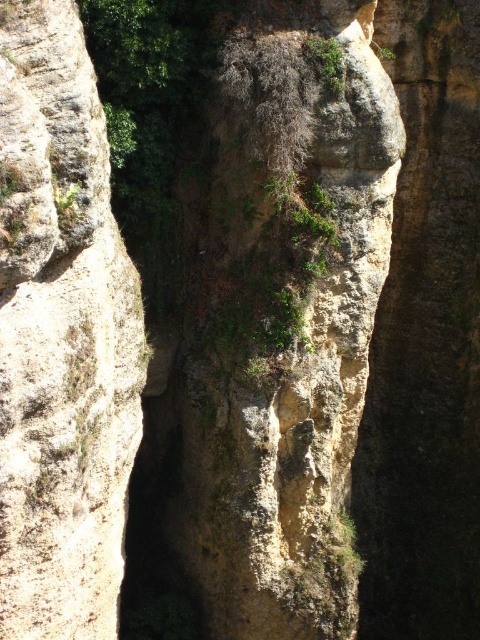
Question: Can you confirm if rough textured rock at center is positioned to the right of green leafy vegetation at upper center?

Choices:
 (A) no
 (B) yes

Answer: (A)

Question: Which point is farther to the camera?

Choices:
 (A) green leafy vegetation at upper center
 (B) rough textured rock at center

Answer: (A)

Question: Does rough textured rock at center come in front of green leafy vegetation at upper center?

Choices:
 (A) no
 (B) yes

Answer: (B)

Question: Among these points, which one is nearest to the camera?

Choices:
 (A) (120, 360)
 (B) (324, 40)

Answer: (A)

Question: Which object appears closest to the camera in this image?

Choices:
 (A) rough textured rock at center
 (B) green leafy vegetation at upper center

Answer: (A)

Question: Can you confirm if rough textured rock at center is positioned below green leafy vegetation at upper center?

Choices:
 (A) no
 (B) yes

Answer: (B)